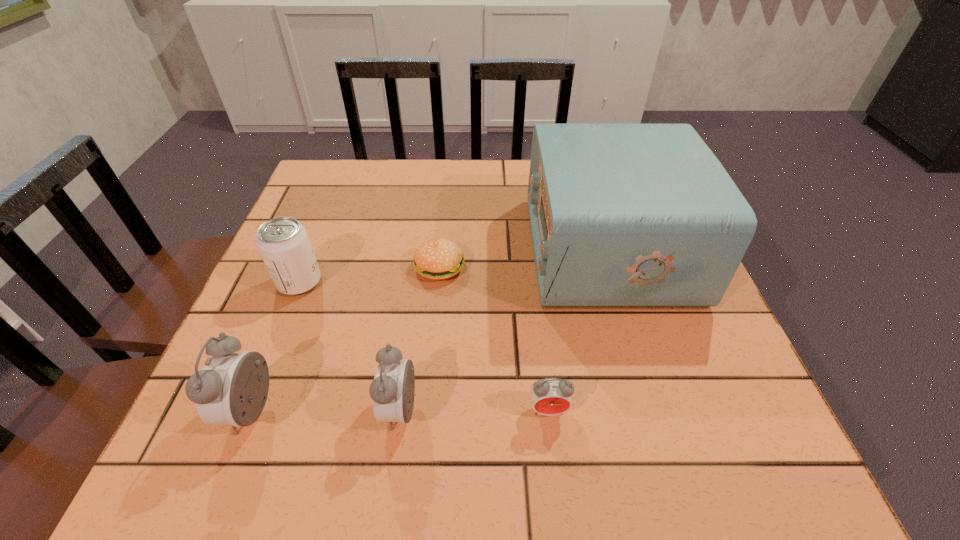
You are a GUI agent. You are given a task and a screenshot of the screen. Output one action in this format:
    pyautogui.click(x=<x>, y=<y>)
    Task: Click on the vacant area that lies between the leftmost alarm clock and the second tallest alarm clock
    Image resolution: width=960 pixels, height=540 pixels.
    Given the screenshot: What is the action you would take?
    pyautogui.click(x=326, y=411)

At what (x,y) coordinates should I click in order to perform the action: click on empty location between the patty and the soda can. Please return your answer as a coordinate pair (x, y). Looking at the image, I should click on (370, 274).

Where is `vacant area that lies between the patty and the second tallest alarm clock`? vacant area that lies between the patty and the second tallest alarm clock is located at coordinates (420, 339).

At what (x,y) coordinates should I click in order to perform the action: click on vacant point located between the soda can and the shortest object. Please return your answer as a coordinate pair (x, y). This screenshot has height=540, width=960. Looking at the image, I should click on (370, 274).

Where is `free space between the fifth tallest object and the tallest object`? This screenshot has width=960, height=540. free space between the fifth tallest object and the tallest object is located at coordinates (578, 329).

Identify the location of object that stands as the second closest to the tallest object. (550, 396).

Locate which object ranks fifth in proximity to the radio receiver. Please provide its 2D coordinates. Your answer should be formatted as a tuple, i.e. [(x, y)], where the tuple contains the x and y coordinates of a point satisfying the conditions above.

[(232, 388)]

Identify which alarm clock is located as the second nearest to the shortest object. Please provide its 2D coordinates. Your answer should be formatted as a tuple, i.e. [(x, y)], where the tuple contains the x and y coordinates of a point satisfying the conditions above.

[(550, 396)]

Identify which alarm clock is the closest to the soda can. Please provide its 2D coordinates. Your answer should be formatted as a tuple, i.e. [(x, y)], where the tuple contains the x and y coordinates of a point satisfying the conditions above.

[(232, 388)]

Locate an element on the screen. The image size is (960, 540). blank space that satisfies the following two spatial constraints: 1. on the front panel of the tallest object; 2. on the face of the shortest alarm clock is located at coordinates (657, 410).